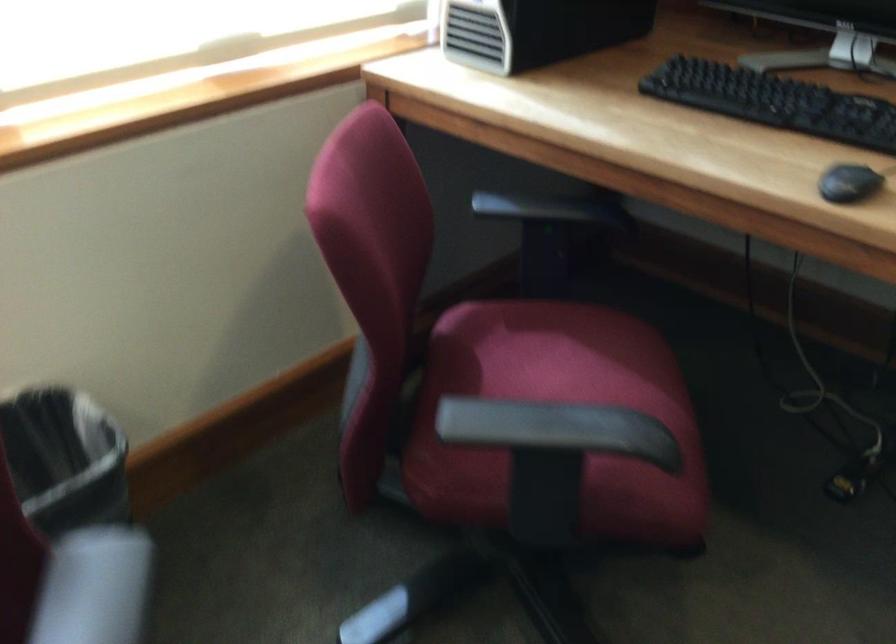
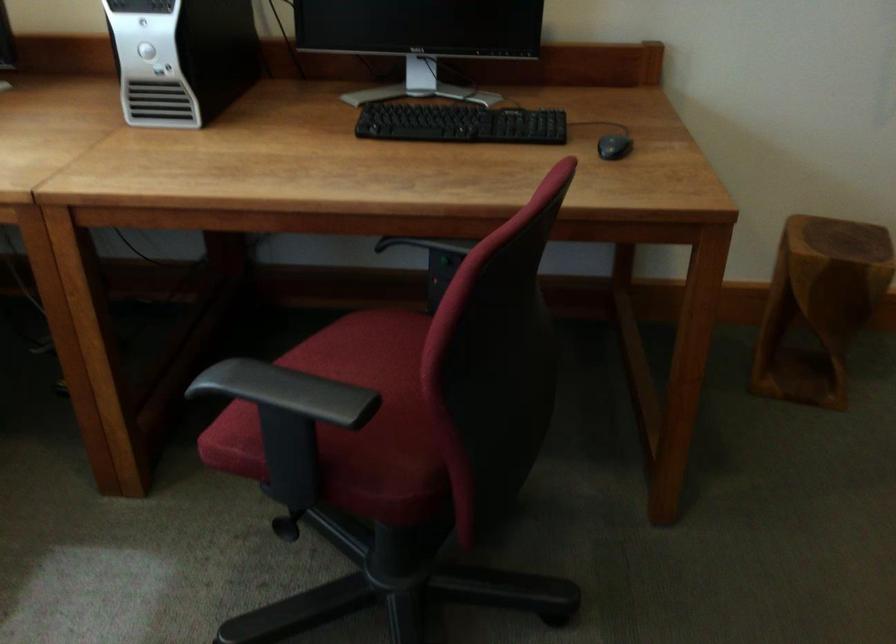
Question: Based on the continuous images, in which direction is the camera rotating? Reply with the corresponding letter.

Choices:
 (A) Left
 (B) Right
 (C) Up
 (D) Down

Answer: (B)